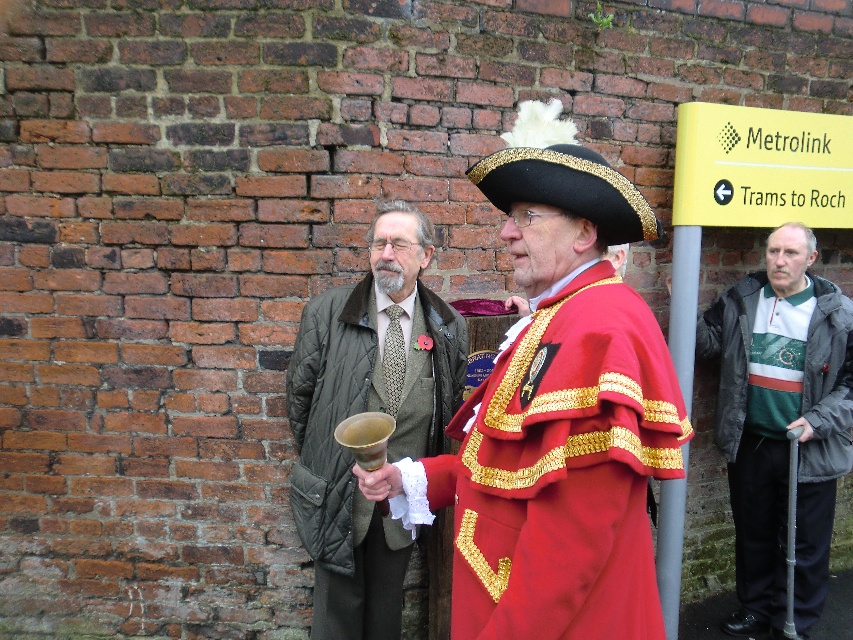
You are a photographer taking a picture of the quilted fabric coat at center and the green and white sweater at right. Which one is closer to the camera?

The quilted fabric coat at center is closer to the camera because it is positioned over the green and white sweater at right.

You are a photographer standing in front of the brick wall backdrop. You need to adjust your camera to focus on both the shiny gold bell at center and the quilted fabric coat at center. Which object should you focus on first to ensure proper depth of field?

The shiny gold bell at center is shorter than the quilted fabric coat at center, so you should focus on the quilted fabric coat at center first to ensure proper depth of field.